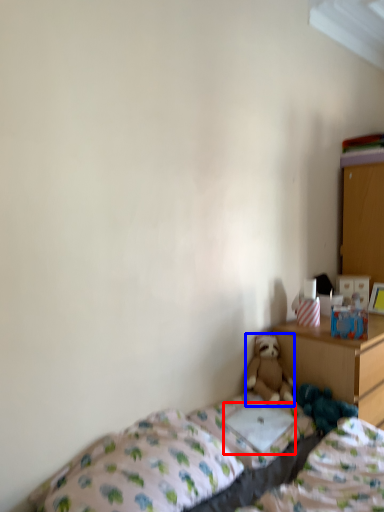
Question: Among these objects, which one is nearest to the camera, pillow (highlighted by a red box) or teddy bear (highlighted by a blue box)?

Choices:
 (A) pillow
 (B) teddy bear

Answer: (A)